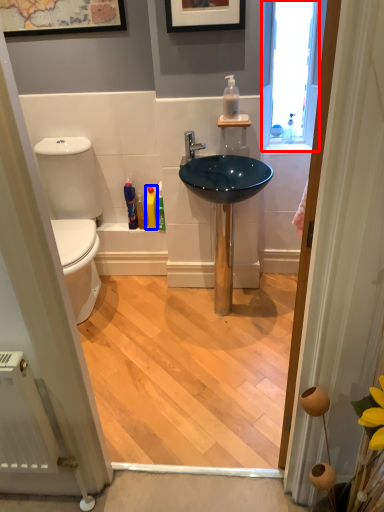
Question: Which point is further to the camera, window (highlighted by a red box) or toiletry (highlighted by a blue box)?

Choices:
 (A) window
 (B) toiletry

Answer: (B)